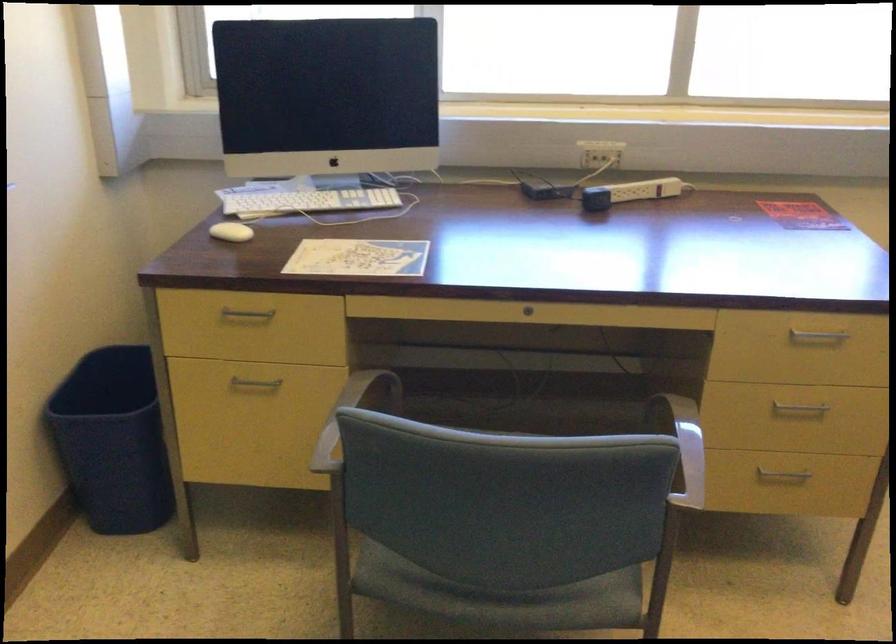
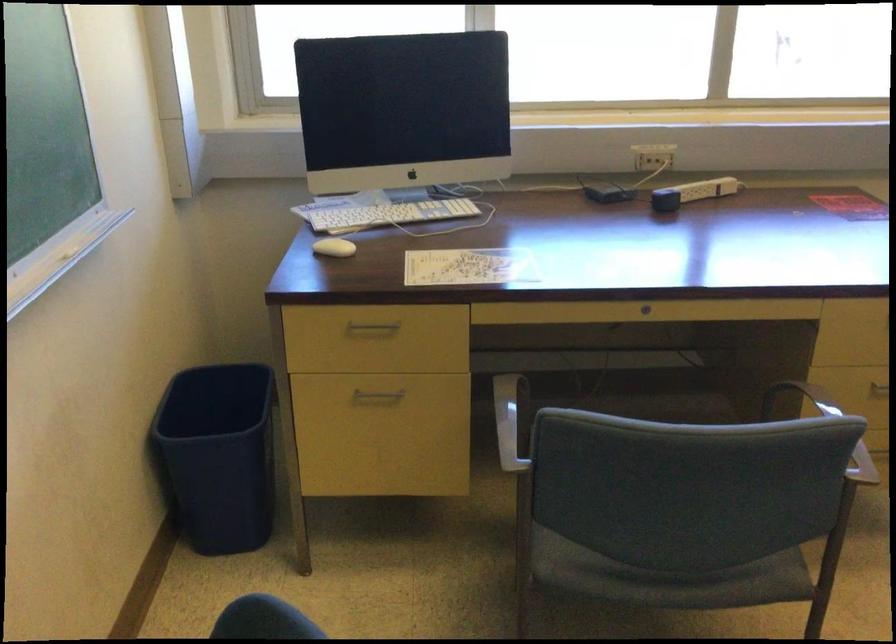
Locate, in the second image, the point that corresponds to point 588,156 in the first image.

(643, 158)